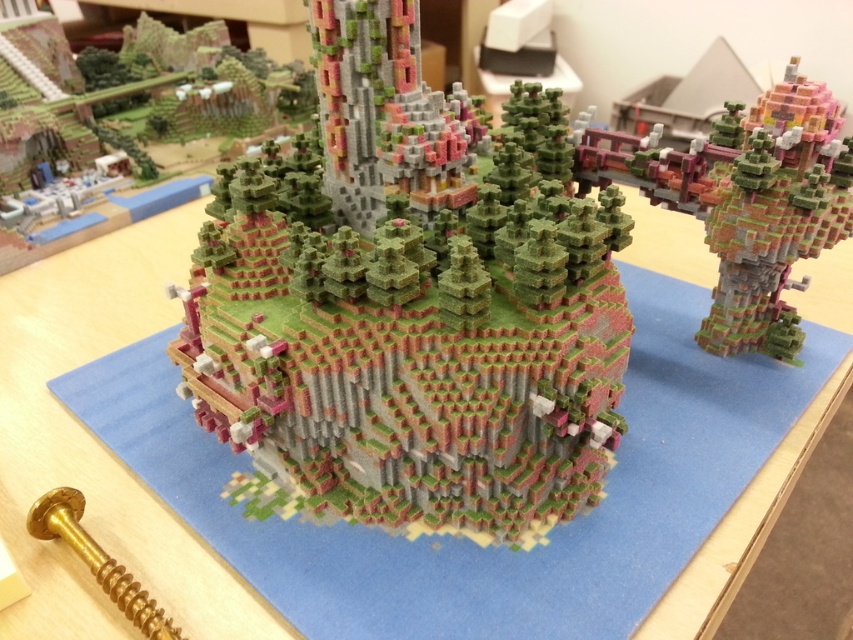
Question: Which point is farther to the camera?

Choices:
 (A) matte pink and green tower at center
 (B) pixelated green tower at center

Answer: (A)

Question: Is the position of pixelated green tower at center less distant than that of gold metallic screw at lower left?

Choices:
 (A) yes
 (B) no

Answer: (B)

Question: Which object appears closest to the camera in this image?

Choices:
 (A) matte pink and green tower at center
 (B) gold metallic screw at lower left

Answer: (B)

Question: Based on their relative distances, which object is nearer to the pixelated green tower at center?

Choices:
 (A) gold metallic screw at lower left
 (B) matte pink and green tower at center

Answer: (B)

Question: Observing the image, what is the correct spatial positioning of pixelated green tower at center in reference to matte pink and green tower at center?

Choices:
 (A) left
 (B) right

Answer: (A)

Question: Can you confirm if matte pink and green tower at center is wider than gold metallic screw at lower left?

Choices:
 (A) yes
 (B) no

Answer: (A)